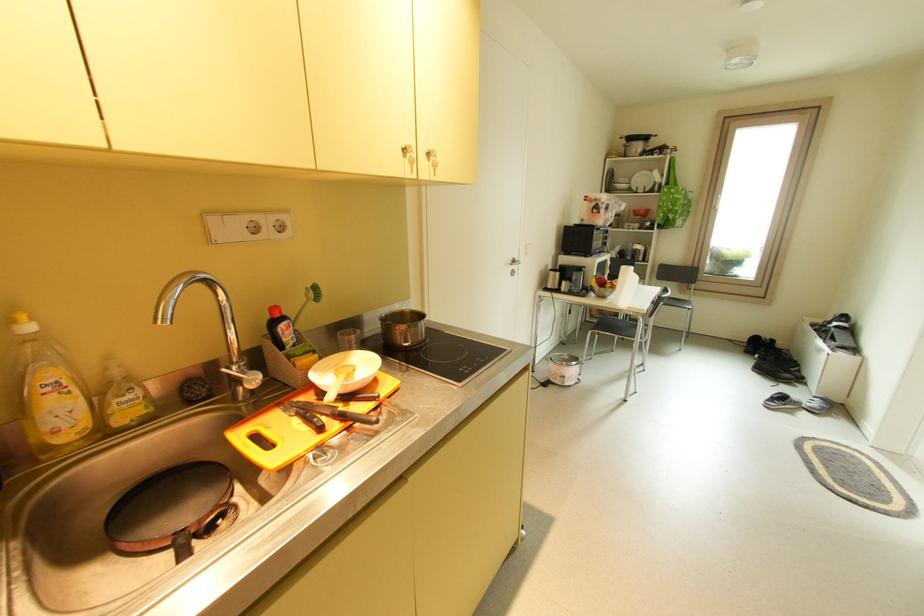
What do you see at coordinates (407, 336) in the screenshot?
I see `the metal pot handle` at bounding box center [407, 336].